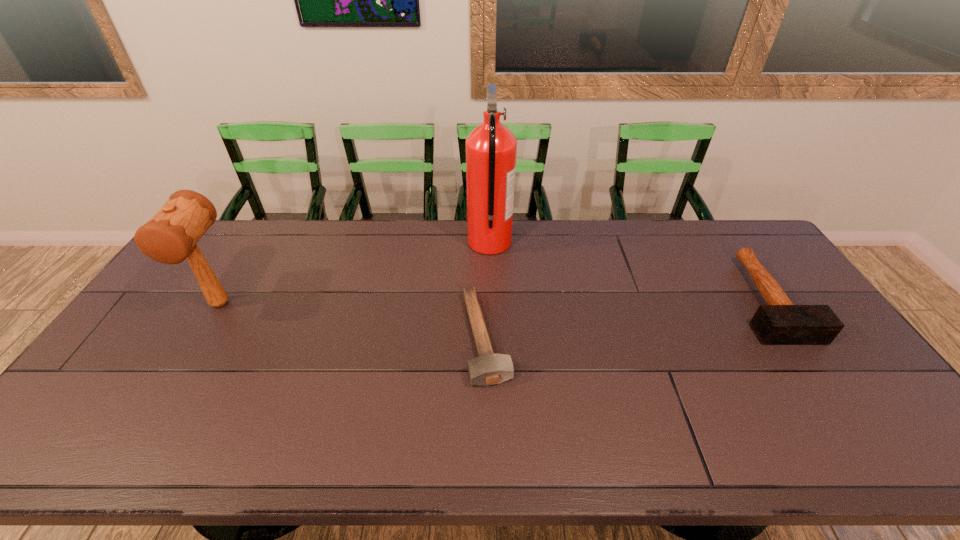
Locate an element on the screen. This screenshot has width=960, height=540. free space between the shortest object and the rightmost object is located at coordinates (625, 318).

I want to click on empty space between the leftmost mallet and the shortest mallet, so click(353, 321).

Image resolution: width=960 pixels, height=540 pixels. Identify the location of vacant space in between the second tallest object and the fire extinguisher. (355, 273).

Where is `object that ranks as the third closest to the shortest object`? object that ranks as the third closest to the shortest object is located at coordinates (780, 322).

Identify which object is the second closest to the tallest mallet. Please provide its 2D coordinates. Your answer should be formatted as a tuple, i.e. [(x, y)], where the tuple contains the x and y coordinates of a point satisfying the conditions above.

[(491, 148)]

Locate which mallet is the closest to the leftmost object. Please provide its 2D coordinates. Your answer should be formatted as a tuple, i.e. [(x, y)], where the tuple contains the x and y coordinates of a point satisfying the conditions above.

[(489, 368)]

Locate which mallet ranks in proximity to the shortest mallet. Please provide its 2D coordinates. Your answer should be formatted as a tuple, i.e. [(x, y)], where the tuple contains the x and y coordinates of a point satisfying the conditions above.

[(171, 235)]

The height and width of the screenshot is (540, 960). I want to click on free space that satisfies the following two spatial constraints: 1. on the strike surface of the third shortest object; 2. on the right side of the second mallet from left to right, so click(200, 338).

Locate an element on the screen. The width and height of the screenshot is (960, 540). vacant point that satisfies the following two spatial constraints: 1. at the nozzle of the tallest object; 2. on the strike surface of the leftmost object is located at coordinates (492, 304).

At what (x,y) coordinates should I click in order to perform the action: click on free space in the image that satisfies the following two spatial constraints: 1. on the strike surface of the second mallet from left to right; 2. on the left side of the leftmost object. Please return your answer as a coordinate pair (x, y). The width and height of the screenshot is (960, 540). Looking at the image, I should click on (200, 338).